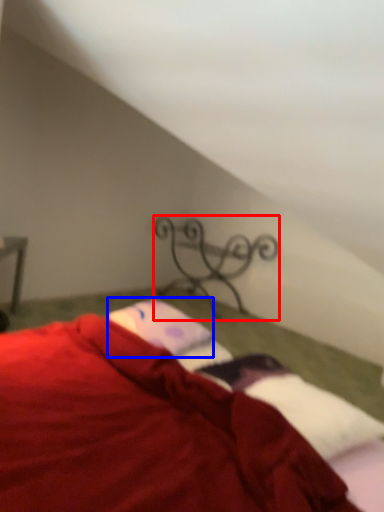
Question: Which of the following is the farthest to the observer, design (highlighted by a red box) or pillow (highlighted by a blue box)?

Choices:
 (A) design
 (B) pillow

Answer: (A)